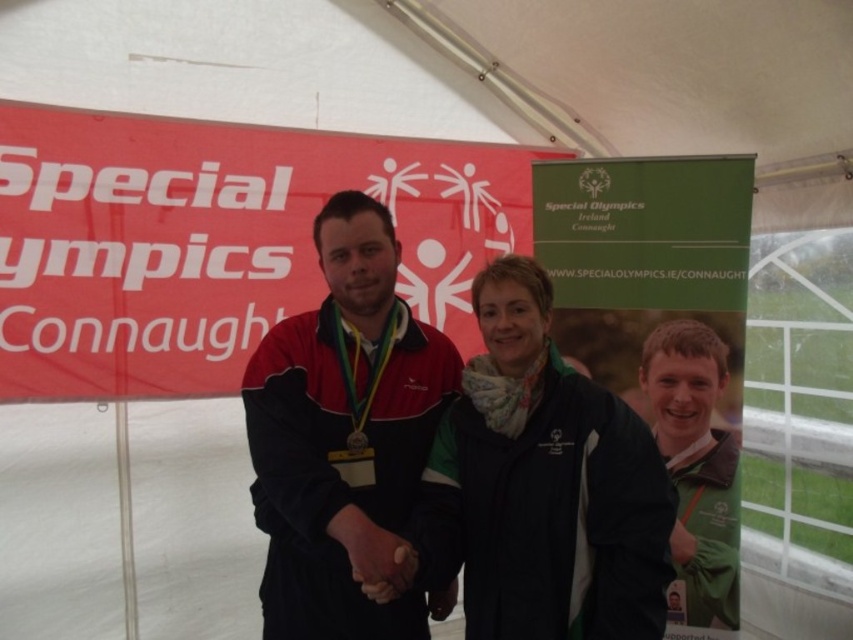
Based on the photo, is the position of matte black jacket at center more distant than that of green fabric jacket at center?

No, it is in front of green fabric jacket at center.

In the scene shown: Measure the distance from matte black jacket at center to green fabric jacket at center.

matte black jacket at center is 1.39 meters from green fabric jacket at center.

Which is in front, point (378, 332) or point (680, 417)?

Positioned in front is point (378, 332).

Locate an element on the screen. This screenshot has height=640, width=853. matte black jacket at center is located at coordinates (345, 436).